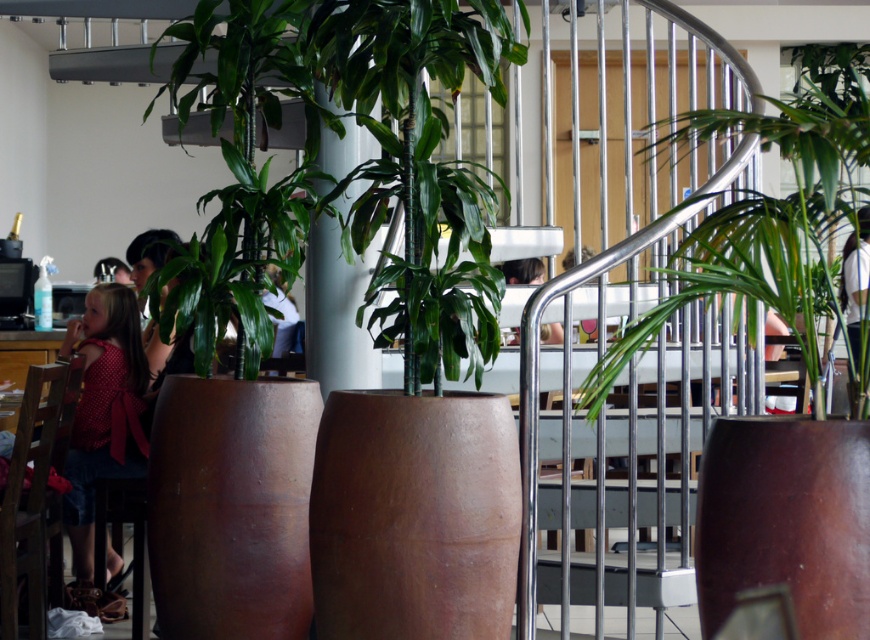
Question: Among these points, which one is nearest to the camera?

Choices:
 (A) (591, 252)
 (B) (748, 300)
 (C) (293, 307)

Answer: (B)

Question: Does green leafy plant at center lie in front of white fabric shirt at center?

Choices:
 (A) no
 (B) yes

Answer: (B)

Question: Does light brown hair at center appear under smooth brown hair at center?

Choices:
 (A) yes
 (B) no

Answer: (B)

Question: Based on their relative distances, which object is nearer to the dotted fabric dress at lower left?

Choices:
 (A) light brown hair at center
 (B) green glossy plant at center
 (C) green leafy plant at center

Answer: (B)

Question: Is light brown hair at center thinner than smooth brown hair at center?

Choices:
 (A) yes
 (B) no

Answer: (B)

Question: Which point is farther from the camera taking this photo?

Choices:
 (A) (831, 228)
 (B) (188, 77)

Answer: (B)